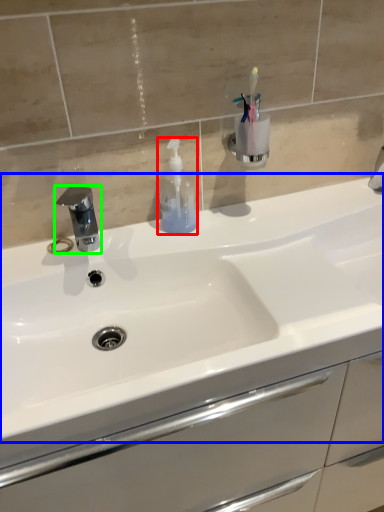
Question: Which is nearer to the soap dispenser (highlighted by a red box)? sink (highlighted by a blue box) or tap (highlighted by a green box).

Choices:
 (A) sink
 (B) tap

Answer: (B)